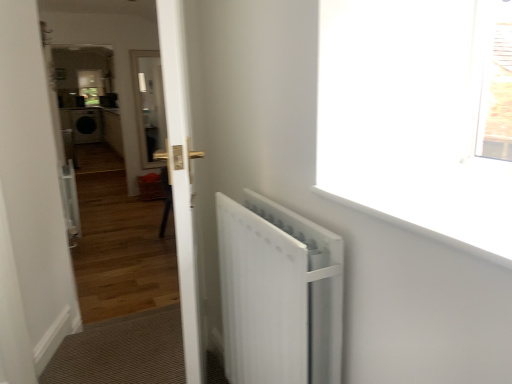
Question: Considering the positions of point (307, 291) and point (173, 92), is point (307, 291) closer or farther from the camera than point (173, 92)?

Choices:
 (A) closer
 (B) farther

Answer: (A)

Question: Considering their positions, is white matte radiator at right located in front of or behind white glossy door at center?

Choices:
 (A) behind
 (B) front

Answer: (B)

Question: Based on their relative distances, which object is nearer to the white glossy door at center?

Choices:
 (A) white smooth window sill at upper right
 (B) white glossy door at center
 (C) white matte radiator at right

Answer: (C)

Question: Estimate the real-world distances between objects in this image. Which object is closer to the white glossy door at center?

Choices:
 (A) white smooth window sill at upper right
 (B) white matte radiator at right
 (C) white glossy door at center

Answer: (C)